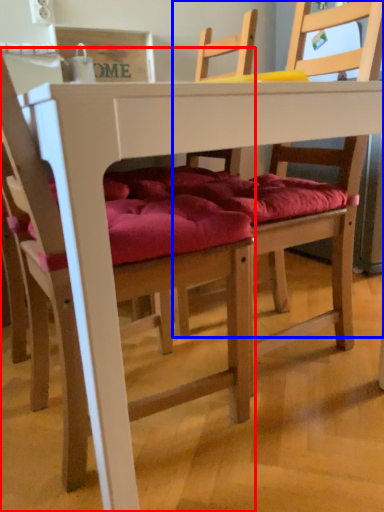
Question: Which object appears closest to the camera in this image, chair (highlighted by a red box) or chair (highlighted by a blue box)?

Choices:
 (A) chair
 (B) chair

Answer: (A)